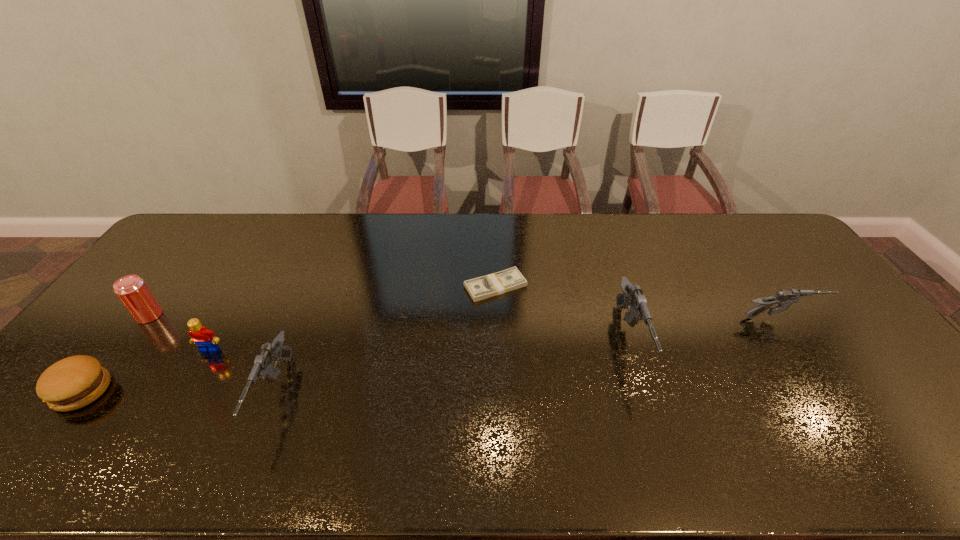
Image resolution: width=960 pixels, height=540 pixels. Find the location of `vacant space located at the barrel of the second object from right to left`. vacant space located at the barrel of the second object from right to left is located at coordinates (655, 418).

The width and height of the screenshot is (960, 540). Find the location of `vacant space located on the back of the third object from right to left`. vacant space located on the back of the third object from right to left is located at coordinates (493, 226).

Locate an element on the screen. Image resolution: width=960 pixels, height=540 pixels. free space located 0.110m on the front-facing side of the fifth object from right to left is located at coordinates (188, 389).

The height and width of the screenshot is (540, 960). I want to click on free space located 0.080m on the left of the beer can, so click(x=110, y=315).

At what (x,y) coordinates should I click in order to perform the action: click on free space located 0.370m on the back of the second shortest object. Please return your answer as a coordinate pair (x, y). The image size is (960, 540). Looking at the image, I should click on (172, 276).

Find the location of a particular element. This screenshot has height=540, width=960. gun present at the near edge is located at coordinates (263, 369).

The height and width of the screenshot is (540, 960). In order to click on hamburger positioned at the near edge in this screenshot , I will do `click(74, 382)`.

Locate an element on the screen. Image resolution: width=960 pixels, height=540 pixels. beer can at the left edge is located at coordinates (132, 291).

In order to click on hamburger that is at the left edge in this screenshot , I will do `click(74, 382)`.

You are a GUI agent. You are given a task and a screenshot of the screen. Output one action in this format:
    pyautogui.click(x=<x>, y=<y>)
    Task: Click on the object situated at the right edge
    
    Given the screenshot: What is the action you would take?
    pyautogui.click(x=784, y=298)